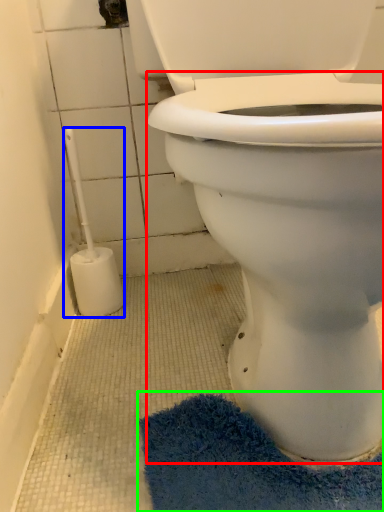
Question: Considering the real-world distances, which object is farthest from bidet (highlighted by a red box)? brush (highlighted by a blue box) or bath mat (highlighted by a green box)?

Choices:
 (A) brush
 (B) bath mat

Answer: (A)